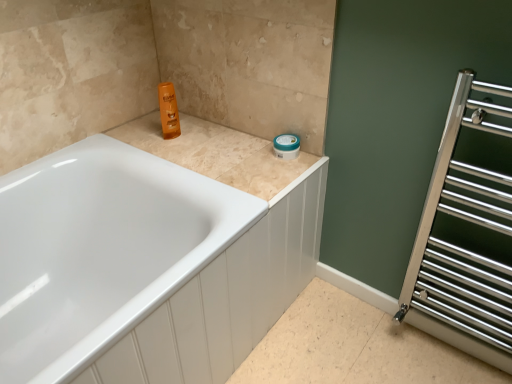
At what (x,y) coordinates should I click in order to perform the action: click on empty space that is ontop of beige tile counter top at upper center (from a real-world perspective). Please return your answer as a coordinate pair (x, y). The image size is (512, 384). Looking at the image, I should click on (216, 147).